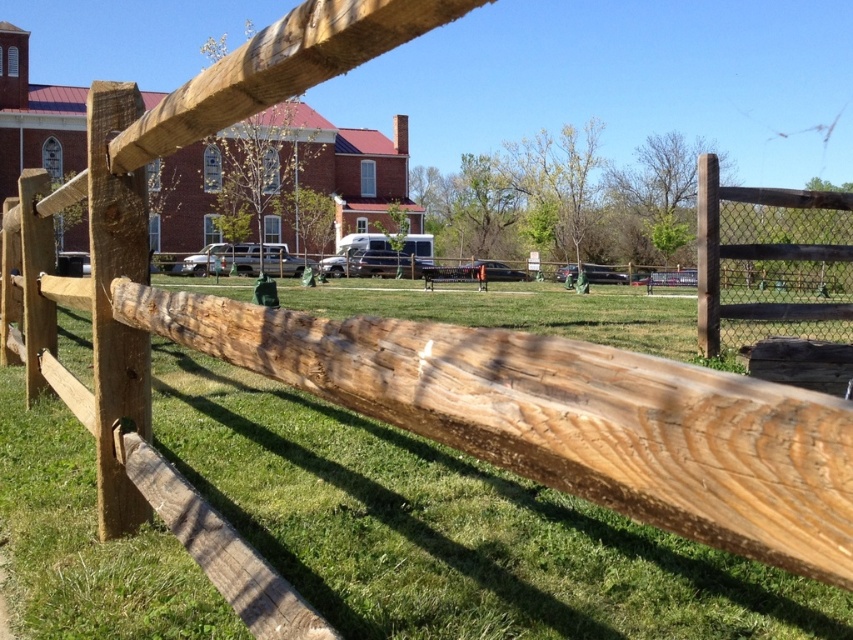
You are standing at the point marked as point (447, 529) in the image. Looking around, you see a rustic wooden fence in the foreground and several parked vehicles including an RV in the midground. Which direction should you walk to reach the RV parked near the center?

The point (447, 529) is on green grass at center, so you are already at the center where the RV is parked. Therefore, you don not need to walk any direction to reach the RV.

You are standing at the viewpoint of the image and want to walk from point A to point B. If point A is at point (277,548) and point B is at point (720,198), which direction should you walk to reach point B without crossing the fence?

Since point (277,548) is in front of point (720,198), you should walk backward or behind to reach point B at (720,198) without crossing the fence.